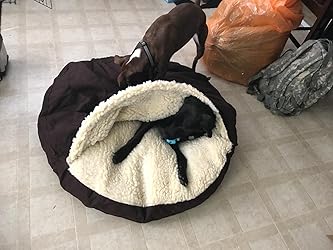
You are a GUI agent. You are given a task and a screenshot of the screen. Output one action in this format:
    pyautogui.click(x=<x>, y=<y>)
    Task: Click on the dog bed
    The image size is (333, 250).
    Given the screenshot: What is the action you would take?
    pyautogui.click(x=95, y=164)